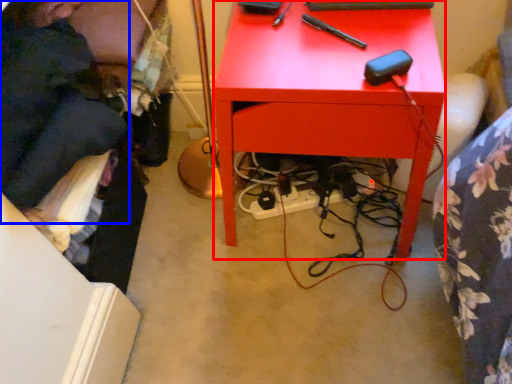
Question: Which point is further to the camera, desk (highlighted by a red box) or person (highlighted by a blue box)?

Choices:
 (A) desk
 (B) person

Answer: (B)